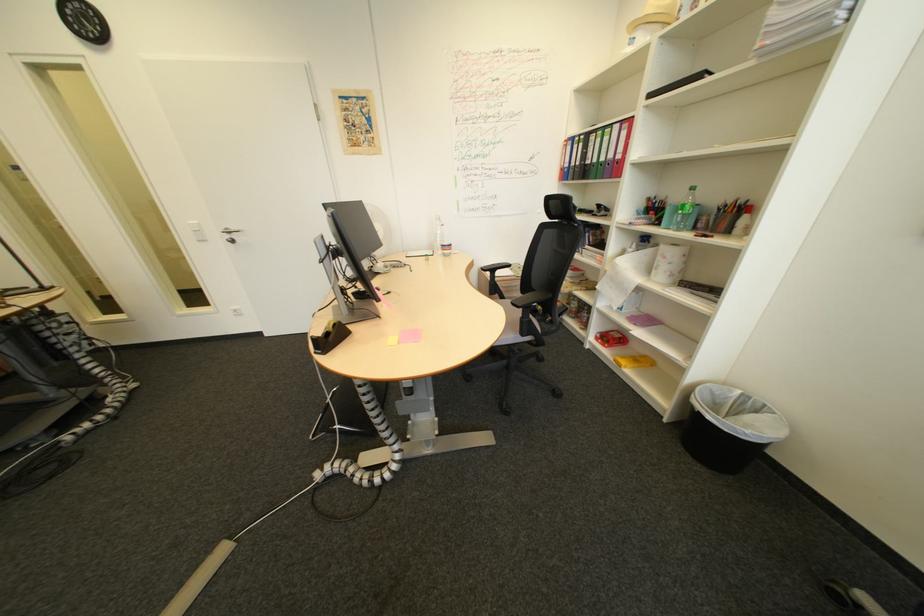
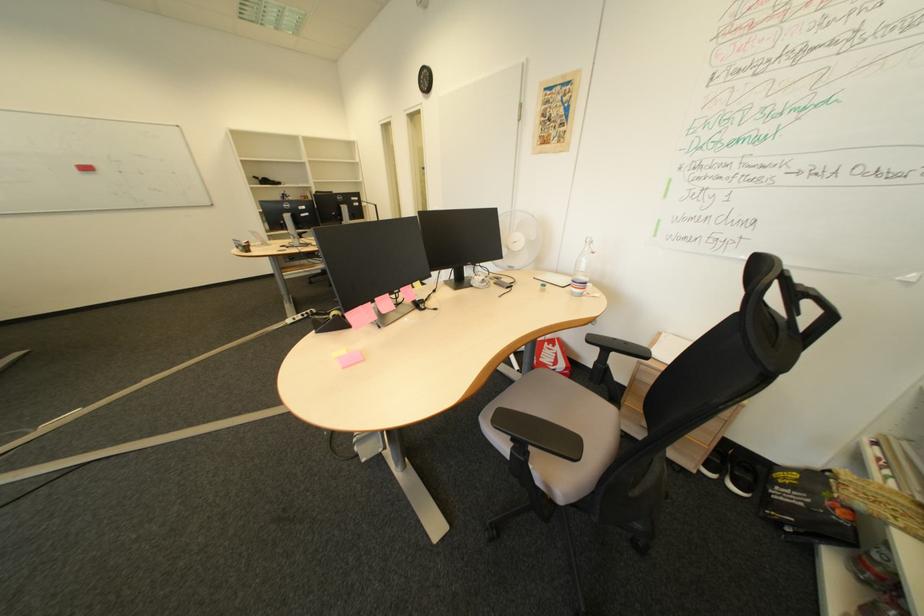
Where in the second image is the point corresponding to pixel 456 246 from the first image?

(587, 282)